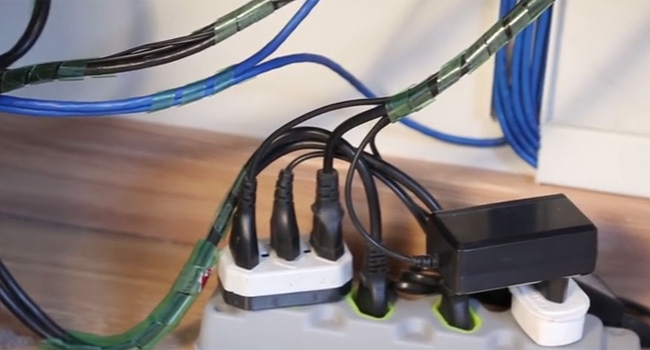
I want to click on plugged in electronics, so click(x=383, y=299), click(x=468, y=318), click(x=556, y=294), click(x=330, y=239), click(x=294, y=236), click(x=244, y=240).